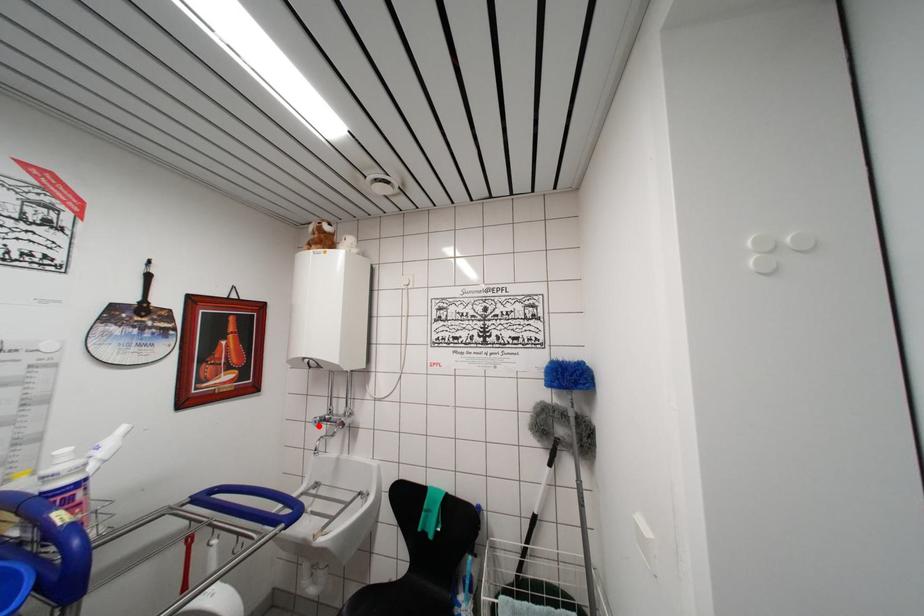
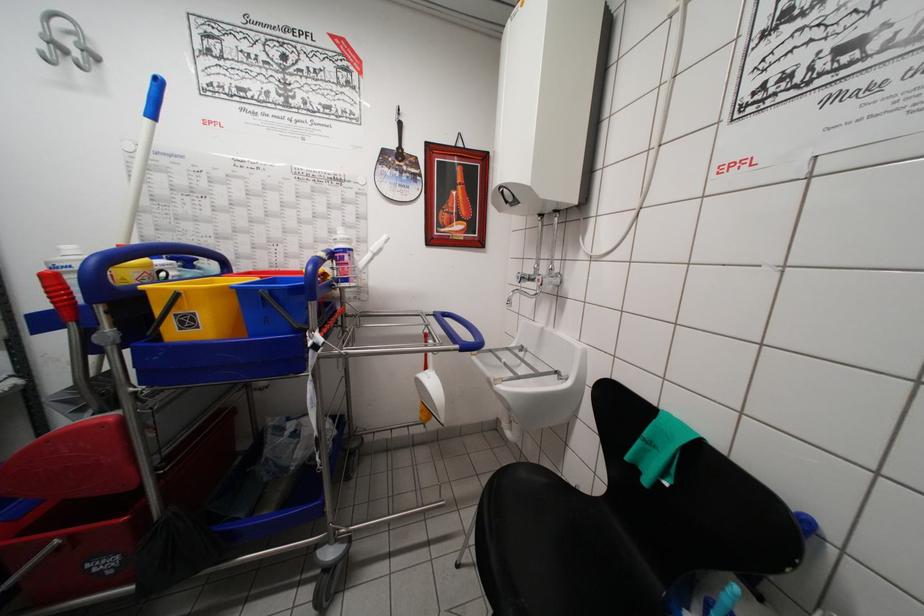
Question: I am providing you with two images of the same scene from different viewpoints. Given a red point in image1, look at the same physical point in image2. Is it:

Choices:
 (A) Closer to the viewpoint
 (B) Farther from the viewpoint

Answer: (A)